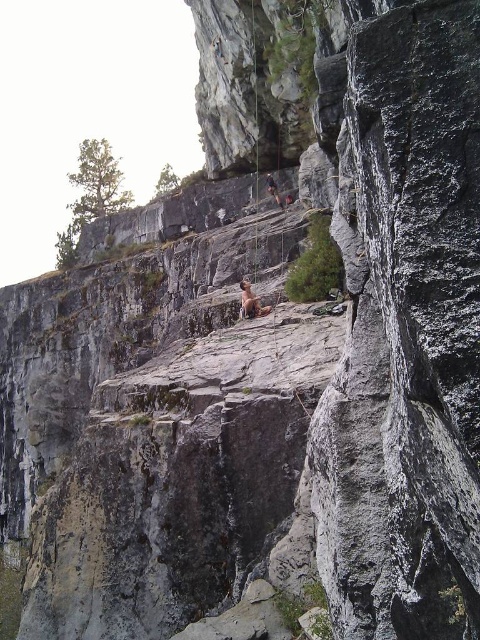
Question: Does smooth tan skin at center appear on the left side of matte gray rock climber at center?

Choices:
 (A) yes
 (B) no

Answer: (A)

Question: Which point is farther to the camera?

Choices:
 (A) (274, 182)
 (B) (252, 301)

Answer: (A)

Question: Which object is farther from the camera taking this photo?

Choices:
 (A) smooth tan skin at center
 (B) matte gray rock climber at center

Answer: (B)

Question: Does smooth tan skin at center have a lesser width compared to matte gray rock climber at center?

Choices:
 (A) yes
 (B) no

Answer: (B)

Question: Can you confirm if smooth tan skin at center is wider than matte gray rock climber at center?

Choices:
 (A) no
 (B) yes

Answer: (B)